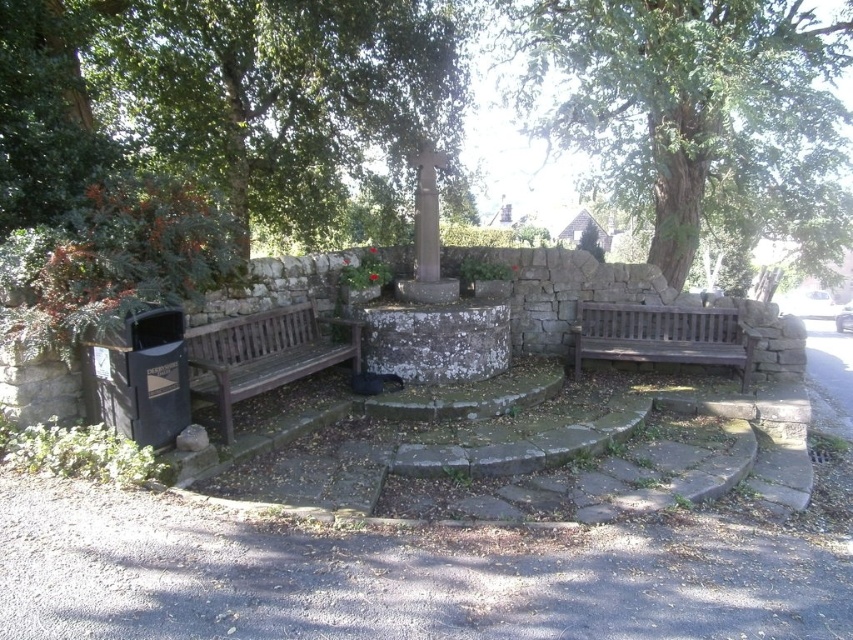
You are planning to host a small gathering at the historical monument. You need to seat 4 people comfortably. Given the wooden bench at left and the smooth stone pillar at center, which object can accommodate more people?

The wooden bench at left can accommodate more people since it has a larger size compared to the smooth stone pillar at center.

You are standing at the entrance of the monument area and want to sit down. You see the wooden bench at left and the smooth stone pillar at center. Which object is closer to you?

The wooden bench at left is closer to you because it is in front of the smooth stone pillar at center, meaning it is positioned nearer to your current location.

You are standing in front of the smooth stone pillar at center and want to look at the green leafy tree at upper center. In which direction should you turn your head?

The green leafy tree at upper center is to the left of the smooth stone pillar at center, so you should turn your head to the left to look at it.